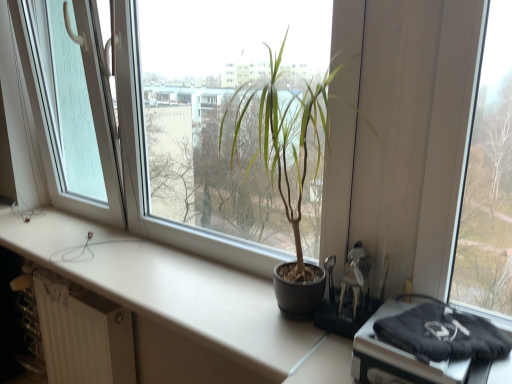
Locate an element on the screen. The image size is (512, 384). vacant region in front of transparent glass door at left is located at coordinates (39, 247).